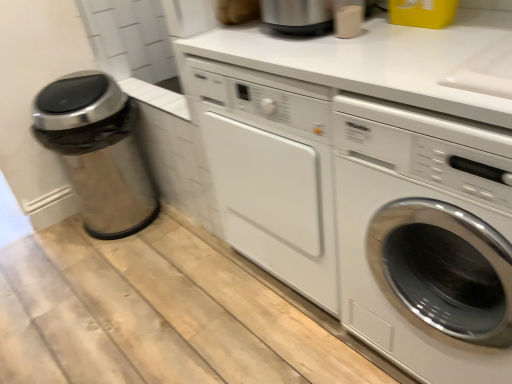
In order to face white glossy washing machine at center right, should I rotate leftwards or rightwards?

You should look right and rotate roughly 27.576 degrees.

At what (x,y) coordinates should I click in order to perform the action: click on white glossy washing machine at center right. Please return your answer as a coordinate pair (x, y). Looking at the image, I should click on (425, 239).

Describe the element at coordinates (425, 239) in the screenshot. I see `white glossy washing machine at center right` at that location.

Consider the image. What is the approximate height of stainless steel trash can at left?

It is 27.70 inches.

Locate an element on the screen. stainless steel trash can at left is located at coordinates (98, 151).

The image size is (512, 384). What do you see at coordinates (98, 151) in the screenshot?
I see `stainless steel trash can at left` at bounding box center [98, 151].

In order to face stainless steel trash can at left, should I rotate leftwards or rightwards?

A 19.776 degree turn to the left will do.

Measure the distance between point (119, 165) and camera.

1.97 meters.

Find the location of a particular element. white glossy washing machine at center right is located at coordinates (425, 239).

Which is more to the right, white glossy washing machine at center right or stainless steel trash can at left?

white glossy washing machine at center right is more to the right.

Is white glossy washing machine at center right closer to the viewer compared to stainless steel trash can at left?

Yes, white glossy washing machine at center right is closer to the viewer.

Which is more distant, (x=411, y=280) or (x=48, y=130)?

The point (x=48, y=130) is farther.

From the image's perspective, is white glossy washing machine at center right located above or below stainless steel trash can at left?

white glossy washing machine at center right is below stainless steel trash can at left.

From a real-world perspective, relative to stainless steel trash can at left, is white glossy washing machine at center right vertically above or below?

Clearly, from a real-world perspective, white glossy washing machine at center right is above stainless steel trash can at left.

Does white glossy washing machine at center right have a lesser width compared to stainless steel trash can at left?

No.

Which of these two, white glossy washing machine at center right or stainless steel trash can at left, stands shorter?

Standing shorter between the two is stainless steel trash can at left.

Who is smaller, white glossy washing machine at center right or stainless steel trash can at left?

stainless steel trash can at left.

Can we say white glossy washing machine at center right lies outside stainless steel trash can at left?

Yes, white glossy washing machine at center right is located beyond the bounds of stainless steel trash can at left.

Is white glossy washing machine at center right not near stainless steel trash can at left?

white glossy washing machine at center right is far away from stainless steel trash can at left.

Is stainless steel trash can at left at the back of white glossy washing machine at center right?

white glossy washing machine at center right is not turned away from stainless steel trash can at left.

The height and width of the screenshot is (384, 512). In order to click on garbage located underneath the white glossy washing machine at center right (from a real-world perspective) in this screenshot , I will do `click(98, 151)`.

Which is more to the left, stainless steel trash can at left or white glossy washing machine at center right?

From the viewer's perspective, stainless steel trash can at left appears more on the left side.

Between stainless steel trash can at left and white glossy washing machine at center right, which one is positioned in front?

white glossy washing machine at center right is closer to the camera.

Which is closer, (114, 146) or (385, 220)?

Clearly, point (114, 146) is more distant from the camera than point (385, 220).

From the image's perspective, is stainless steel trash can at left positioned above or below white glossy washing machine at center right?

Based on their image positions, stainless steel trash can at left is located above white glossy washing machine at center right.

From a real-world perspective, which object stands above the other?

From a 3D spatial view, white glossy washing machine at center right is above.

Between stainless steel trash can at left and white glossy washing machine at center right, which one has larger width?

white glossy washing machine at center right is wider.

In the scene shown: Who is shorter, stainless steel trash can at left or white glossy washing machine at center right?

Standing shorter between the two is stainless steel trash can at left.

Who is smaller, stainless steel trash can at left or white glossy washing machine at center right?

stainless steel trash can at left is smaller.

Is stainless steel trash can at left situated inside white glossy washing machine at center right or outside?

stainless steel trash can at left is located beyond the bounds of white glossy washing machine at center right.

Is stainless steel trash can at left not near white glossy washing machine at center right?

stainless steel trash can at left is positioned a significant distance from white glossy washing machine at center right.

Is stainless steel trash can at left turned away from white glossy washing machine at center right?

No, white glossy washing machine at center right is not at the back of stainless steel trash can at left.

Can you tell me how much stainless steel trash can at left and white glossy washing machine at center right differ in facing direction?

stainless steel trash can at left and white glossy washing machine at center right are facing 91.5 degrees away from each other.

How distant is stainless steel trash can at left from white glossy washing machine at center right?

stainless steel trash can at left is 1.27 meters from white glossy washing machine at center right.

The width and height of the screenshot is (512, 384). I want to click on garbage above the white glossy washing machine at center right (from the image's perspective), so click(x=98, y=151).

Identify the location of garbage on the left of white glossy washing machine at center right. The image size is (512, 384). (98, 151).

Find the location of a particular element. washing machine below the stainless steel trash can at left (from the image's perspective) is located at coordinates (425, 239).